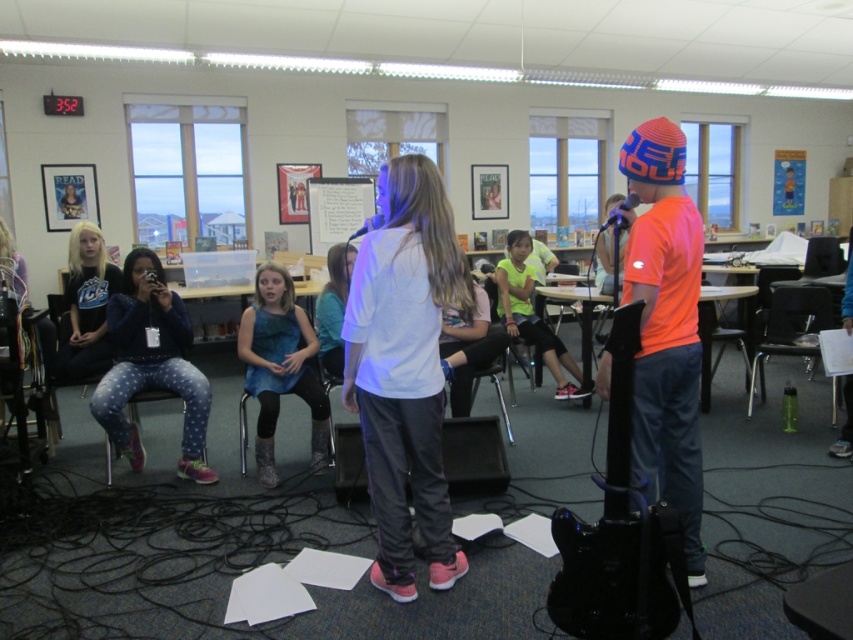
Does orange knit beanie at upper right have a lesser width compared to matte black shirt at left?

In fact, orange knit beanie at upper right might be wider than matte black shirt at left.

Can you confirm if orange knit beanie at upper right is smaller than matte black shirt at left?

Incorrect, orange knit beanie at upper right is not smaller in size than matte black shirt at left.

Which is in front, point (642, 172) or point (119, 282)?

Point (642, 172)

Where is `orange knit beanie at upper right`? The width and height of the screenshot is (853, 640). orange knit beanie at upper right is located at coordinates (665, 326).

Is point (624, 435) behind point (550, 337)?

No, (624, 435) is in front of (550, 337).

Between point (608, 588) and point (525, 268), which one is positioned behind?

The point (525, 268) is behind.

Who is more distant from viewer, (627, 412) or (560, 342)?

The point (560, 342) is more distant.

You are a GUI agent. You are given a task and a screenshot of the screen. Output one action in this format:
    pyautogui.click(x=<x>, y=<y>)
    Task: Click on the black glossy electric guitar at lower right
    This screenshot has height=640, width=853.
    Given the screenshot: What is the action you would take?
    pyautogui.click(x=619, y=532)

Can you confirm if blue polka dot jeans at left is thinner than neon yellow shirt at center?

In fact, blue polka dot jeans at left might be wider than neon yellow shirt at center.

Who is more distant from viewer, (115, 380) or (554, 353)?

The point (554, 353) is behind.

Identify the location of blue polka dot jeans at left. Image resolution: width=853 pixels, height=640 pixels. tap(151, 364).